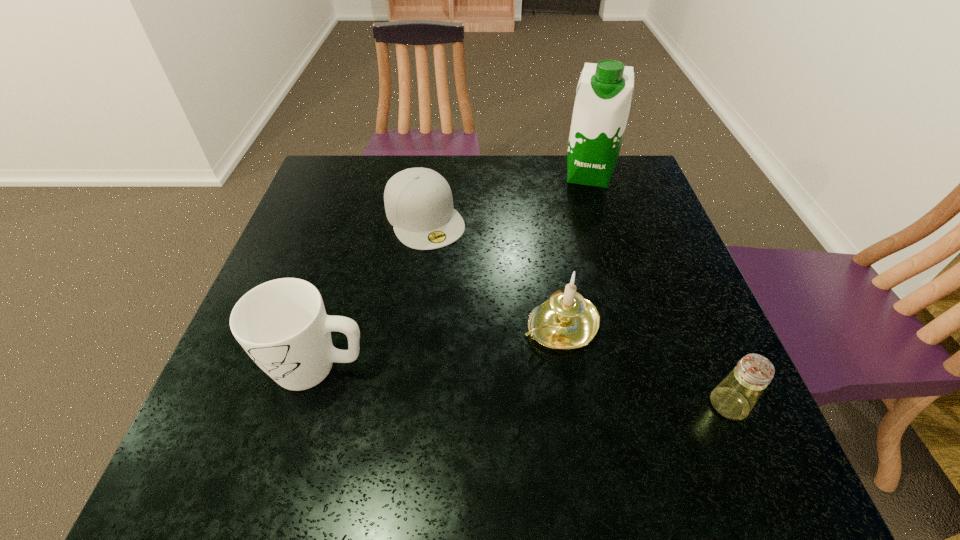
This screenshot has width=960, height=540. Identify the location of vacant region at the far left corner. (348, 178).

Locate an element on the screen. The image size is (960, 540). free space between the shortest object and the candle holder is located at coordinates (492, 272).

The image size is (960, 540). I want to click on vacant point located between the soya milk and the mug, so click(x=453, y=271).

Identify the location of free spot between the shortest object and the mug. The height and width of the screenshot is (540, 960). [372, 292].

Where is `free space between the candle holder and the cap`? Image resolution: width=960 pixels, height=540 pixels. free space between the candle holder and the cap is located at coordinates (492, 272).

Locate an element on the screen. vacant region between the candle holder and the shortest object is located at coordinates (492, 272).

Image resolution: width=960 pixels, height=540 pixels. What are the coordinates of `empty location between the mug and the cap` in the screenshot? It's located at (372, 292).

Locate an element on the screen. This screenshot has width=960, height=540. unoccupied area between the soya milk and the cap is located at coordinates (507, 196).

At what (x,y) coordinates should I click in order to perform the action: click on vacant space that's between the rightmost object and the mug. Please return your answer as a coordinate pair (x, y). The image size is (960, 540). Looking at the image, I should click on (523, 386).

Identify the location of object that stands as the closest to the shortest object. This screenshot has height=540, width=960. (566, 321).